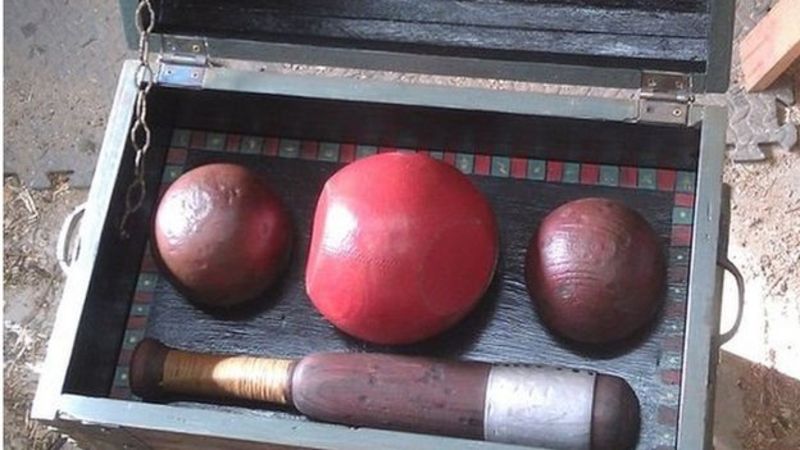
Identify the location of hinge. The width and height of the screenshot is (800, 450). (186, 59), (664, 97).